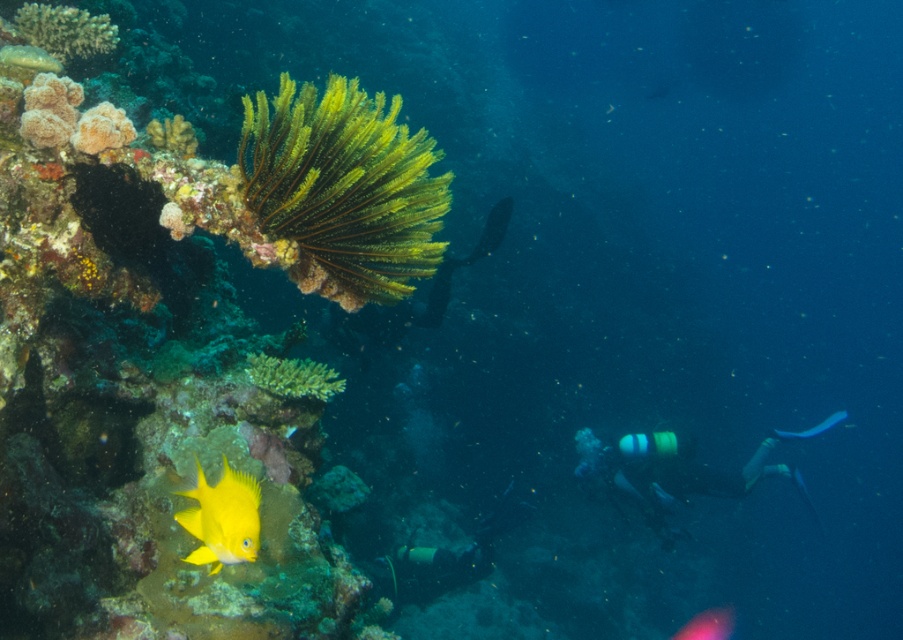
Is the position of green matte coral at upper left more distant than that of shiny yellow fish at lower left?

Yes, green matte coral at upper left is behind shiny yellow fish at lower left.

Is point (248, 147) positioned behind point (229, 502)?

Yes, point (248, 147) is farther from viewer.

Find the location of a particular element. green matte coral at upper left is located at coordinates (343, 188).

How much distance is there between green matte coral at upper left and yellow matte fish at lower left?

green matte coral at upper left and yellow matte fish at lower left are 9.23 meters apart from each other.

What are the coordinates of `green matte coral at upper left` in the screenshot? It's located at (343, 188).

Between point (731, 608) and point (776, 436), which one is positioned behind?

The point (731, 608) is more distant.

Where is `yellow matte fish at lower left`? Image resolution: width=903 pixels, height=640 pixels. yellow matte fish at lower left is located at coordinates (708, 625).

Is point (710, 611) in front of point (840, 410)?

Yes, it is in front of point (840, 410).

This screenshot has height=640, width=903. What are the coordinates of `yellow matte fish at lower left` in the screenshot? It's located at (708, 625).